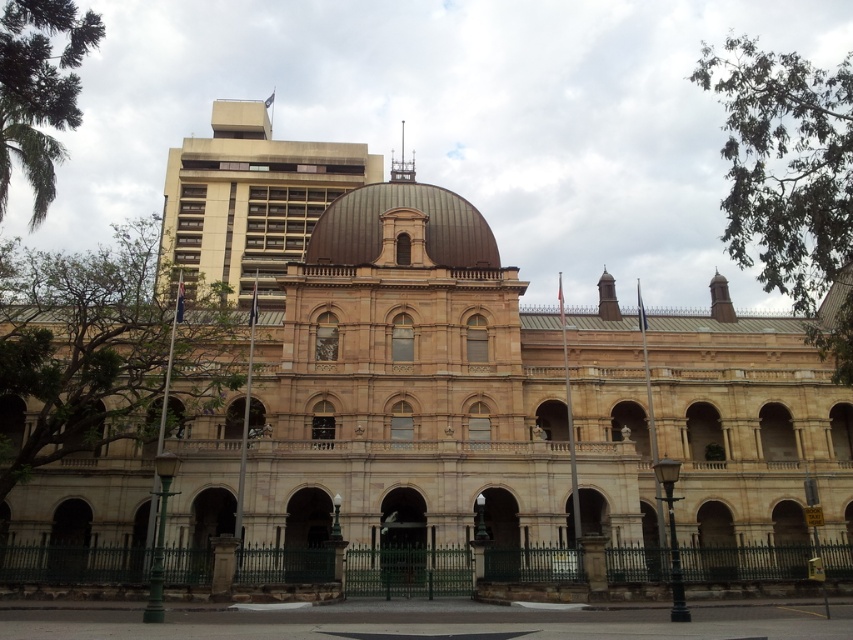
Question: Considering the relative positions of beige stone dome at upper center and brown metallic dome at center in the image provided, where is beige stone dome at upper center located with respect to brown metallic dome at center?

Choices:
 (A) above
 (B) below

Answer: (A)

Question: Among these objects, which one is farthest from the camera?

Choices:
 (A) beige stone dome at upper center
 (B) brown metallic dome at center

Answer: (A)

Question: Which point appears closest to the camera in this image?

Choices:
 (A) (467, 211)
 (B) (256, 214)

Answer: (A)

Question: From the image, what is the correct spatial relationship of beige stone dome at upper center in relation to brown metallic dome at center?

Choices:
 (A) above
 (B) below

Answer: (A)

Question: Is beige stone dome at upper center to the right of brown metallic dome at center from the viewer's perspective?

Choices:
 (A) yes
 (B) no

Answer: (B)